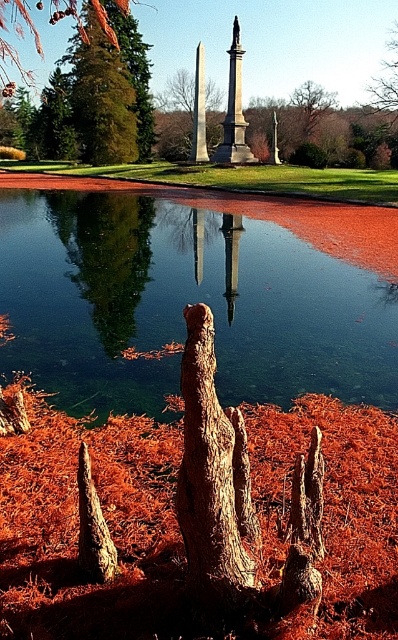
Can you confirm if clear water at center is wider than brown rough tree at center?

Yes, clear water at center is wider than brown rough tree at center.

Can you confirm if clear water at center is thinner than brown rough tree at center?

No.

Who is more distant from viewer, (124, 250) or (396, 166)?

The point (396, 166) is behind.

This screenshot has width=398, height=640. I want to click on clear water at center, so click(183, 305).

Does point (146, 93) lie in front of point (234, 163)?

No, (146, 93) is further to viewer.

The width and height of the screenshot is (398, 640). I want to click on green textured tree at upper left, so click(128, 60).

The image size is (398, 640). Find the location of `green textured tree at upper left`. green textured tree at upper left is located at coordinates (128, 60).

The height and width of the screenshot is (640, 398). What do you see at coordinates (384, 104) in the screenshot?
I see `brown rough tree at center` at bounding box center [384, 104].

Where is `brown rough tree at center`? The height and width of the screenshot is (640, 398). brown rough tree at center is located at coordinates (384, 104).

Between point (386, 140) and point (241, 116), which one is positioned in front?

Point (241, 116)

Find the location of a particular element. Image resolution: width=398 pixels, height=640 pixels. brown rough tree at center is located at coordinates (384, 104).